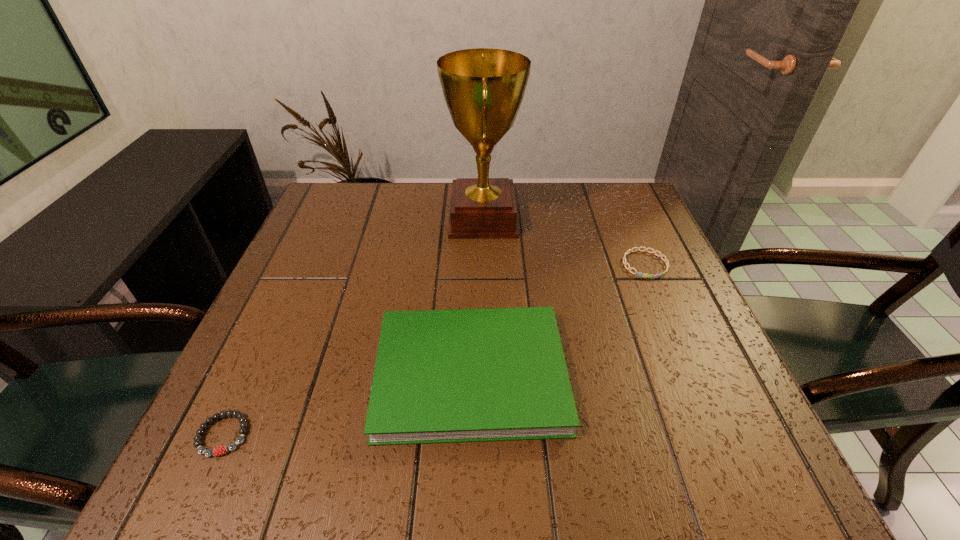
Locate an element on the screen. This screenshot has height=540, width=960. award is located at coordinates (483, 88).

This screenshot has width=960, height=540. What are the coordinates of `the second tallest object` in the screenshot? It's located at (493, 374).

Find the location of a particular element. the farther bracelet is located at coordinates (666, 261).

The width and height of the screenshot is (960, 540). Find the location of `the rightmost object`. the rightmost object is located at coordinates (666, 261).

Locate an element on the screen. The image size is (960, 540). the left bracelet is located at coordinates (218, 451).

At what (x,y) coordinates should I click in order to perform the action: click on the nearer bracelet. Please return your answer as a coordinate pair (x, y). Image resolution: width=960 pixels, height=540 pixels. Looking at the image, I should click on (218, 451).

Where is `free space located on the plaque of the tallest object`? The image size is (960, 540). free space located on the plaque of the tallest object is located at coordinates (326, 219).

Locate an element on the screen. Image resolution: width=960 pixels, height=540 pixels. vacant space located 0.210m on the plaque of the tallest object is located at coordinates (368, 219).

In order to click on free location located 0.060m on the plaque of the tallest object in this screenshot , I will do `click(423, 219)`.

This screenshot has width=960, height=540. I want to click on free space located 0.120m on the back of the second tallest object, so click(x=472, y=278).